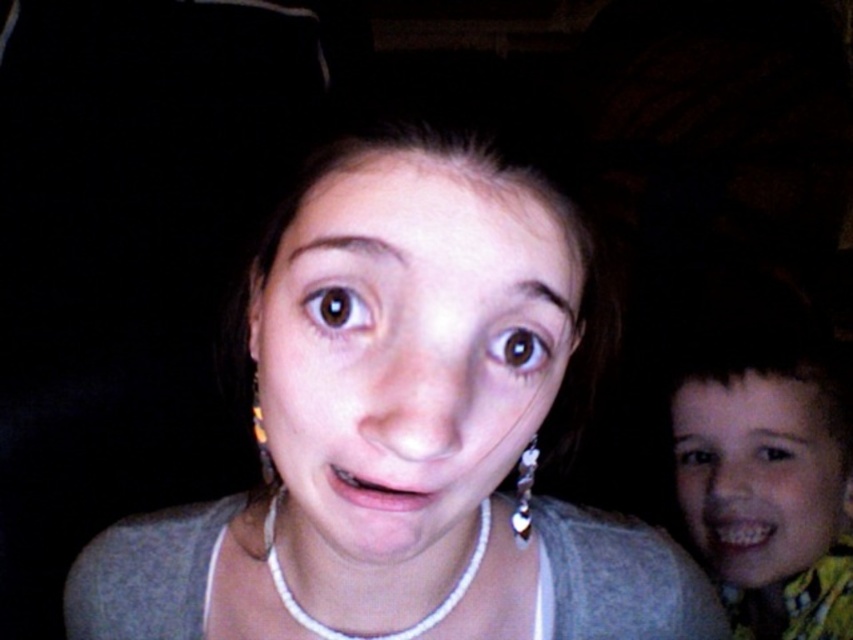
You are a photographer adjusting the focus on your camera. You want to ensure both the yellow patterned shirt at right and the brown glossy eye at upper center are in focus. Given the depth of field, what is the minimum distance the camera needs to be focused at to achieve this?

The minimum focusing distance should be set to 26.79 inches between the yellow patterned shirt at right and the brown glossy eye at upper center to ensure both are in focus.

You are a photographer analyzing this image. You need to focus on the brown glossy eye at upper center. Where exactly is it located in terms of coordinates?

The brown glossy eye at upper center is located at coordinates point (x=518, y=348).